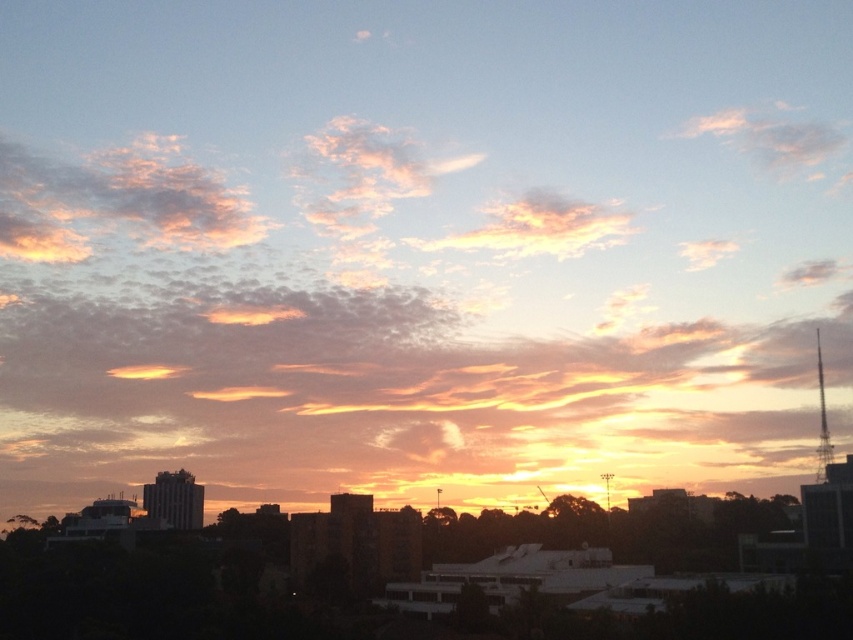
Does golden-orange cotton clouds at center appear on the right side of pastel cotton clouds at center?

Incorrect, golden-orange cotton clouds at center is not on the right side of pastel cotton clouds at center.

Does golden-orange cotton clouds at center appear over pastel cotton clouds at center?

No.

Is point (792, 291) in front of point (534, 248)?

No.

Find the location of a particular element. This screenshot has height=640, width=853. golden-orange cotton clouds at center is located at coordinates (421, 330).

Is golden-orange cotton clouds at center positioned in front of pink fluffy cloud at upper right?

Yes, golden-orange cotton clouds at center is closer to the viewer.

Is golden-orange cotton clouds at center to the right of pink fluffy cloud at upper right from the viewer's perspective?

Incorrect, golden-orange cotton clouds at center is not on the right side of pink fluffy cloud at upper right.

Between point (302, 211) and point (815, 176), which one is positioned in front?

Point (302, 211)

The image size is (853, 640). I want to click on golden-orange cotton clouds at center, so pos(421,330).

Can you confirm if pastel pink cotton clouds at upper left is smaller than pastel cotton clouds at center?

No, pastel pink cotton clouds at upper left is not smaller than pastel cotton clouds at center.

Identify the location of pastel pink cotton clouds at upper left. The height and width of the screenshot is (640, 853). (115, 200).

Does point (16, 193) come closer to viewer compared to point (488, 244)?

No, it is not.

Locate an element on the screen. The height and width of the screenshot is (640, 853). pastel pink cotton clouds at upper left is located at coordinates (115, 200).